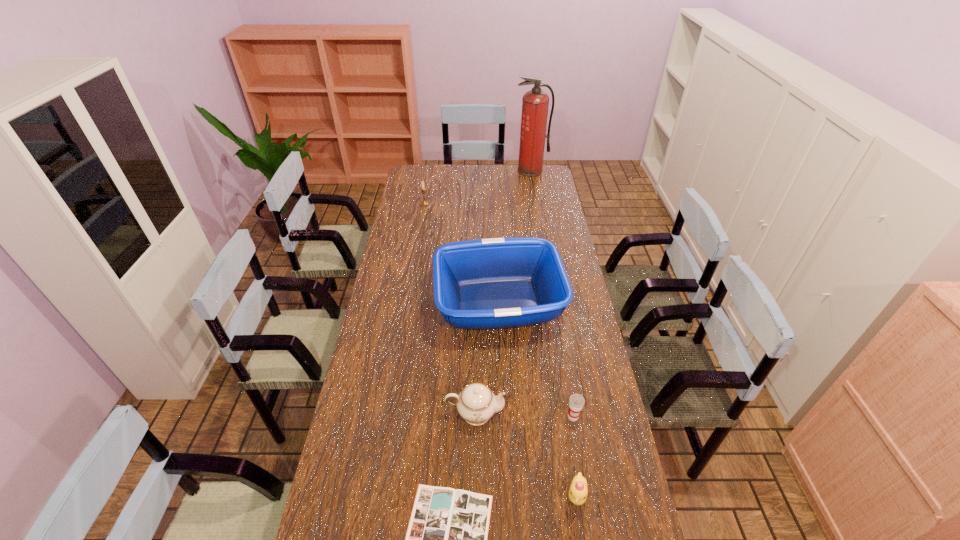
Find the location of a particular element. Image resolution: width=960 pixels, height=540 pixels. duckling that is at the right edge is located at coordinates (578, 491).

Locate an element on the screen. object located in the far right corner section of the desktop is located at coordinates [x=535, y=103].

I want to click on blank space at the far edge of the desktop, so [467, 168].

At what (x,y) coordinates should I click in order to perform the action: click on vacant space at the left edge of the desktop. Please return your answer as a coordinate pair (x, y). The width and height of the screenshot is (960, 540). Looking at the image, I should click on (356, 434).

The image size is (960, 540). In order to click on vacant space at the right edge in this screenshot , I will do `click(564, 266)`.

This screenshot has width=960, height=540. Find the location of `vacant area at the far right corner`. vacant area at the far right corner is located at coordinates (550, 187).

At what (x,y) coordinates should I click in order to perform the action: click on empty space that is in between the sixth nearest object and the second shortest object. Please return your answer as a coordinate pair (x, y). This screenshot has height=540, width=960. Looking at the image, I should click on (500, 349).

Where is `vacant area that lies between the fire extinguisher and the fifth nearest object`? vacant area that lies between the fire extinguisher and the fifth nearest object is located at coordinates (515, 237).

At what (x,y) coordinates should I click in order to perform the action: click on free point between the second shortest object and the sixth nearest object. Please return your answer as a coordinate pair (x, y). The width and height of the screenshot is (960, 540). Looking at the image, I should click on click(x=500, y=349).

Locate an element on the screen. This screenshot has height=540, width=960. vacant area that lies between the tray and the sixth tallest object is located at coordinates (538, 399).